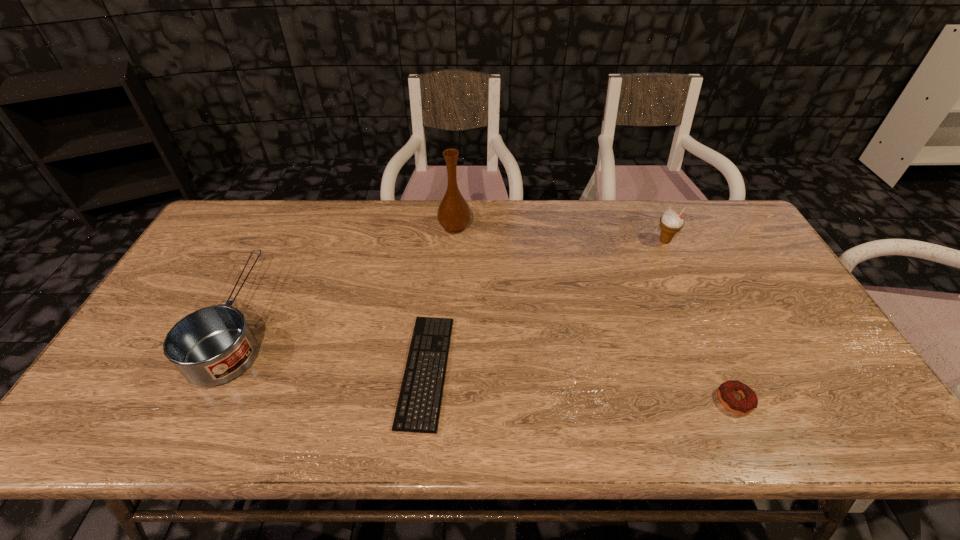
I want to click on vacant space at the left edge, so [164, 316].

At what (x,y) coordinates should I click in order to perform the action: click on vacant space at the right edge of the desktop. Please return your answer as a coordinate pair (x, y). This screenshot has width=960, height=540. Looking at the image, I should click on (844, 374).

Where is `free space between the fourth shortest object and the shortest object`? The height and width of the screenshot is (540, 960). free space between the fourth shortest object and the shortest object is located at coordinates [x=545, y=306].

Locate an element on the screen. empty location between the saucepan and the shortest object is located at coordinates (333, 346).

Find the location of `vacant area that lies between the saucepan and the doughnut`. vacant area that lies between the saucepan and the doughnut is located at coordinates (488, 361).

The width and height of the screenshot is (960, 540). I want to click on empty space that is in between the vase and the shortest object, so click(441, 299).

You are a GUI agent. You are given a task and a screenshot of the screen. Output one action in this format:
    pyautogui.click(x=<x>, y=<y>)
    Task: Click on the empty space between the icecream and the second shortest object
    This screenshot has height=540, width=960.
    Given the screenshot: What is the action you would take?
    pyautogui.click(x=700, y=321)

Locate an element on the screen. vacant point located between the doughnut and the tallest object is located at coordinates (594, 314).

This screenshot has width=960, height=540. What are the coordinates of `free space between the doughnut and the second tallest object` in the screenshot? It's located at (700, 321).

Where is `blank region between the third tallest object and the vase`? The image size is (960, 540). blank region between the third tallest object and the vase is located at coordinates (348, 274).